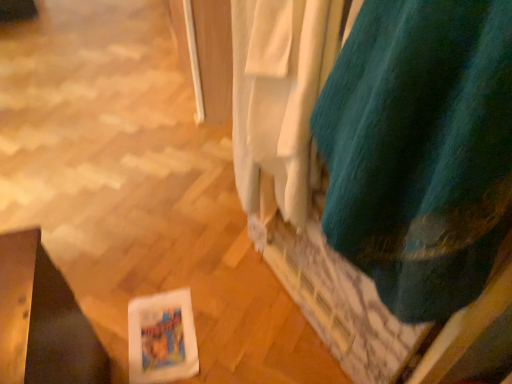
Question: Would you say teal felt curtain at right, the second curtain positioned from the left, is outside teal fabric curtain at upper right, which is the 2th curtain in right-to-left order?

Choices:
 (A) no
 (B) yes

Answer: (B)

Question: Does teal felt curtain at right, arranged as the first curtain when viewed from the right, have a smaller size compared to teal fabric curtain at upper right, which is the 2th curtain in right-to-left order?

Choices:
 (A) yes
 (B) no

Answer: (B)

Question: From a real-world perspective, is teal felt curtain at right, the second curtain positioned from the left, positioned under teal fabric curtain at upper right, which is the 1th curtain in left-to-right order, based on gravity?

Choices:
 (A) no
 (B) yes

Answer: (A)

Question: Can you confirm if teal felt curtain at right, arranged as the first curtain when viewed from the right, is wider than teal fabric curtain at upper right, which is the 1th curtain in left-to-right order?

Choices:
 (A) no
 (B) yes

Answer: (B)

Question: From the image's perspective, is teal felt curtain at right, the second curtain positioned from the left, on top of teal fabric curtain at upper right, which is the 1th curtain in left-to-right order?

Choices:
 (A) no
 (B) yes

Answer: (A)

Question: Could teal fabric curtain at upper right, which is the 2th curtain in right-to-left order, be considered to be inside teal felt curtain at right, the second curtain positioned from the left?

Choices:
 (A) yes
 (B) no

Answer: (B)

Question: Considering the relative positions of teal fabric curtain at upper right, which is the 1th curtain in left-to-right order, and teal felt curtain at right, the second curtain positioned from the left, in the image provided, is teal fabric curtain at upper right, which is the 1th curtain in left-to-right order, to the right of teal felt curtain at right, the second curtain positioned from the left, from the viewer's perspective?

Choices:
 (A) no
 (B) yes

Answer: (A)

Question: Is teal fabric curtain at upper right, which is the 1th curtain in left-to-right order, aimed at teal felt curtain at right, arranged as the first curtain when viewed from the right?

Choices:
 (A) no
 (B) yes

Answer: (A)

Question: Can you confirm if teal fabric curtain at upper right, which is the 2th curtain in right-to-left order, is wider than teal felt curtain at right, the second curtain positioned from the left?

Choices:
 (A) yes
 (B) no

Answer: (B)

Question: Can you confirm if teal fabric curtain at upper right, which is the 1th curtain in left-to-right order, is smaller than teal felt curtain at right, arranged as the first curtain when viewed from the right?

Choices:
 (A) yes
 (B) no

Answer: (A)

Question: Does teal fabric curtain at upper right, which is the 2th curtain in right-to-left order, touch teal felt curtain at right, arranged as the first curtain when viewed from the right?

Choices:
 (A) yes
 (B) no

Answer: (B)

Question: Is teal felt curtain at right, the second curtain positioned from the left, inside teal fabric curtain at upper right, which is the 2th curtain in right-to-left order?

Choices:
 (A) yes
 (B) no

Answer: (B)

Question: Considering the relative positions of teal fabric curtain at upper right, which is the 2th curtain in right-to-left order, and teal felt curtain at right, the second curtain positioned from the left, in the image provided, is teal fabric curtain at upper right, which is the 2th curtain in right-to-left order, to the left or to the right of teal felt curtain at right, the second curtain positioned from the left,?

Choices:
 (A) right
 (B) left

Answer: (B)